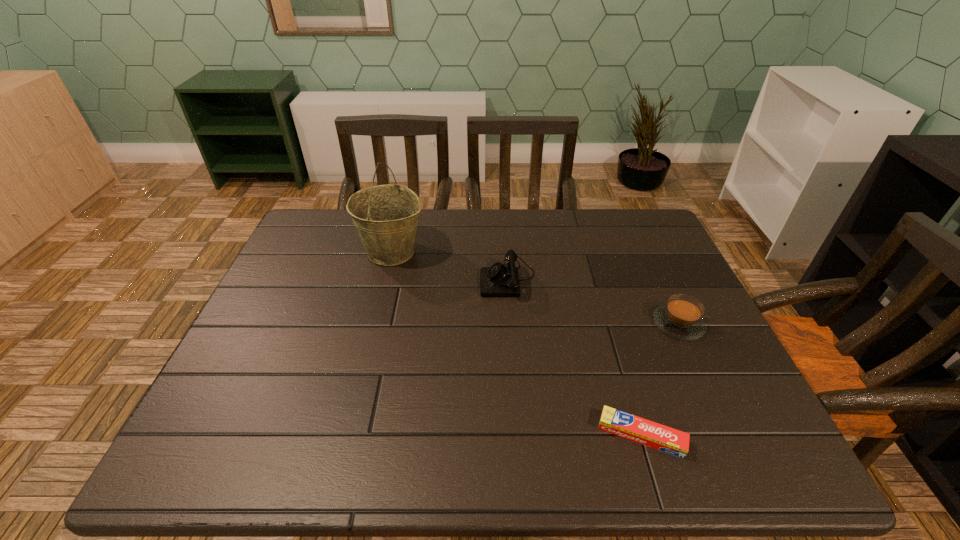
You are a GUI agent. You are given a task and a screenshot of the screen. Output one action in this format:
    pyautogui.click(x=<x>, y=<y>)
    Task: Click on the free spot that satisfies the following two spatial constraints: 1. on the front face of the third object from left to right; 2. on the left side of the telephone
    This screenshot has width=960, height=540.
    Given the screenshot: What is the action you would take?
    pyautogui.click(x=519, y=435)

Identify the location of free location that satisfies the following two spatial constraints: 1. on the front face of the second tallest object; 2. on the left side of the third object from left to right. (519, 435).